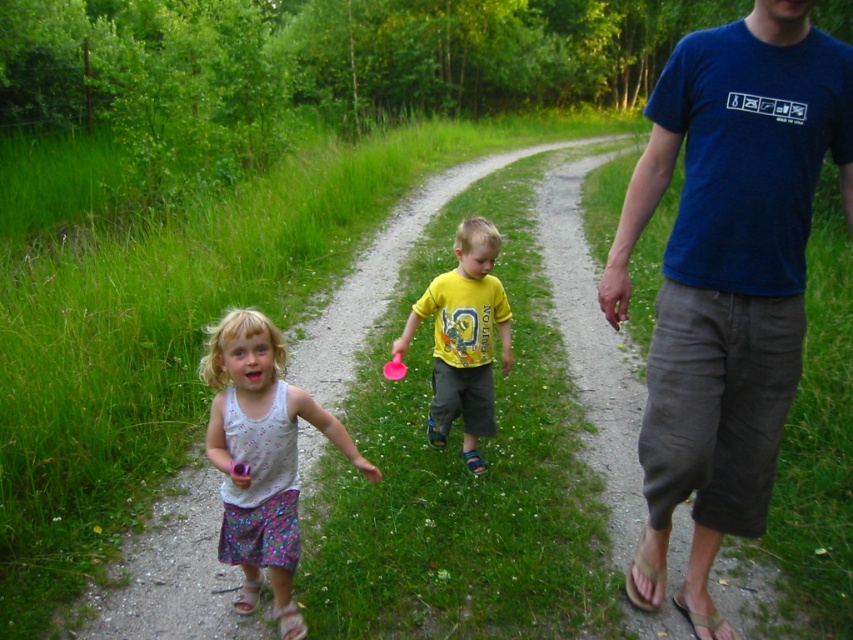
The height and width of the screenshot is (640, 853). Find the location of `blue cotton t-shirt at center`. blue cotton t-shirt at center is located at coordinates (727, 275).

Between point (762, 282) and point (253, 588), which one is positioned in front?

Positioned in front is point (762, 282).

This screenshot has width=853, height=640. In order to click on blue cotton t-shirt at center in this screenshot , I will do `click(727, 275)`.

Does white printed tank top at center have a smaller size compared to pink rubber ball at center?

Actually, white printed tank top at center might be larger than pink rubber ball at center.

Does white printed tank top at center appear on the left side of pink rubber ball at center?

Yes, white printed tank top at center is to the left of pink rubber ball at center.

Which is behind, point (207, 346) or point (393, 355)?

The point (207, 346) is behind.

Identify the location of white printed tank top at center. (260, 458).

Is yellow matte shirt at center thinner than pink rubber ball at center?

Incorrect, yellow matte shirt at center's width is not less than pink rubber ball at center's.

Who is positioned more to the left, yellow matte shirt at center or pink rubber ball at center?

pink rubber ball at center is more to the left.

Where is `yellow matte shirt at center`? Image resolution: width=853 pixels, height=640 pixels. yellow matte shirt at center is located at coordinates (463, 339).

What are the coordinates of `yellow matte shirt at center` in the screenshot? It's located at click(x=463, y=339).